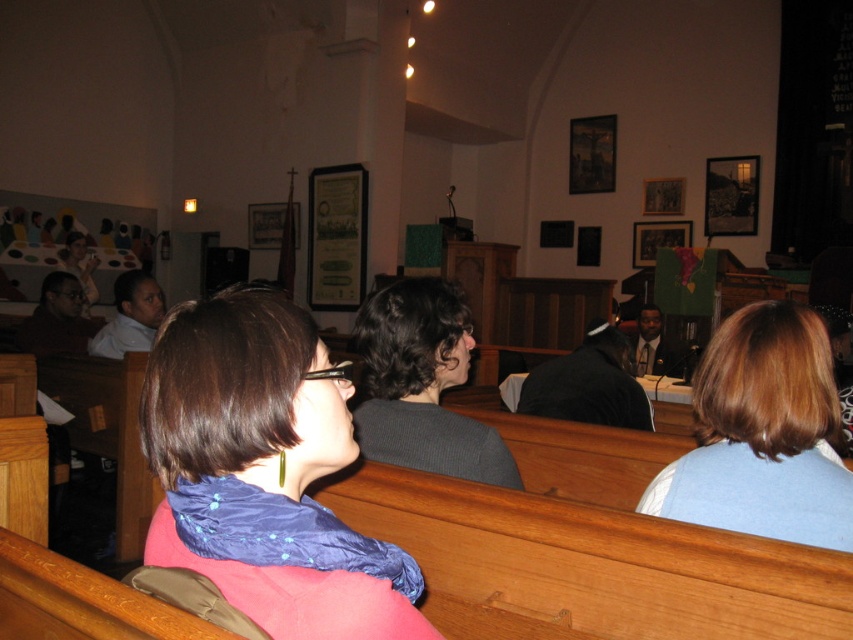
Is point (764, 339) positioned before point (398, 381)?

Yes, point (764, 339) is in front of point (398, 381).

Where is `light brown hair at right`? This screenshot has height=640, width=853. light brown hair at right is located at coordinates (763, 435).

Who is positioned more to the right, light brown hair at right or matte black laptop at upper left?

light brown hair at right is more to the right.

Who is more forward, (769, 481) or (88, 289)?

Point (769, 481)

Locate an element on the screen. The image size is (853, 640). light brown hair at right is located at coordinates (763, 435).

The height and width of the screenshot is (640, 853). Find the location of `light brown hair at right`. light brown hair at right is located at coordinates (763, 435).

Can you confirm if blue satin scarf at center is bigger than dark gray sweater at center?

No.

Is blue satin scarf at center below dark gray sweater at center?

No, blue satin scarf at center is not below dark gray sweater at center.

Between point (289, 536) and point (409, 374), which one is positioned in front?

Point (289, 536) is more forward.

The image size is (853, 640). In order to click on blue satin scarf at center in this screenshot , I will do `click(265, 472)`.